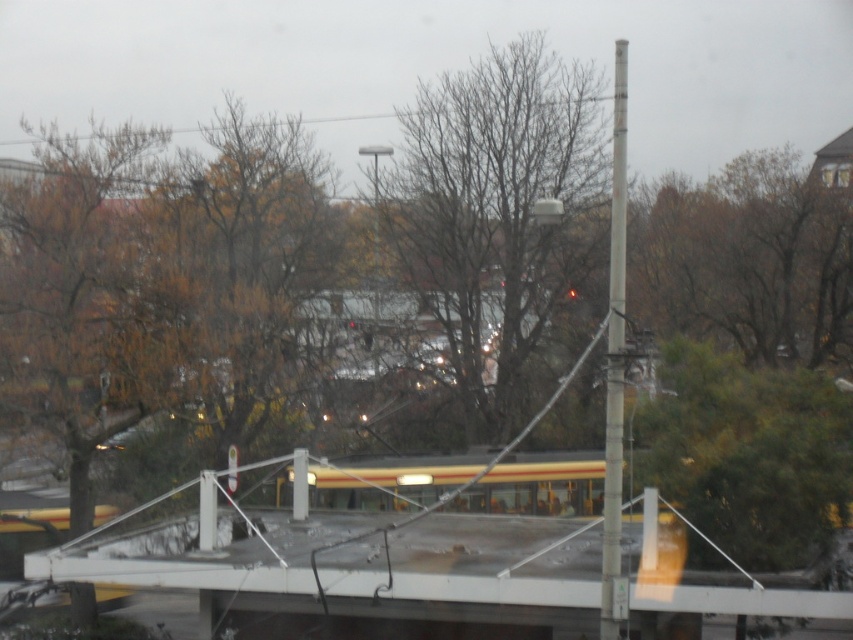
Is bare branches at center taller than yellow striped school bus at center?

Indeed, bare branches at center has a greater height compared to yellow striped school bus at center.

Between point (566, 115) and point (357, 484), which one is positioned in front?

Point (357, 484)

At what (x,y) coordinates should I click in order to perform the action: click on bare branches at center. Please return your answer as a coordinate pair (x, y). This screenshot has width=853, height=640. Looking at the image, I should click on click(498, 211).

From the picture: Who is more distant from viewer, (537, 125) or (618, 596)?

The point (537, 125) is behind.

Where is `bare branches at center`? bare branches at center is located at coordinates (498, 211).

Where is `bare branches at center`? The image size is (853, 640). bare branches at center is located at coordinates (498, 211).

How far apart are yellow striped school bus at center and metallic gray pole at right?

yellow striped school bus at center is 6.52 meters away from metallic gray pole at right.

Describe the element at coordinates (538, 486) in the screenshot. This screenshot has width=853, height=640. I see `yellow striped school bus at center` at that location.

At what (x,y) coordinates should I click in order to perform the action: click on yellow striped school bus at center. Please return your answer as a coordinate pair (x, y). This screenshot has width=853, height=640. Looking at the image, I should click on (538, 486).